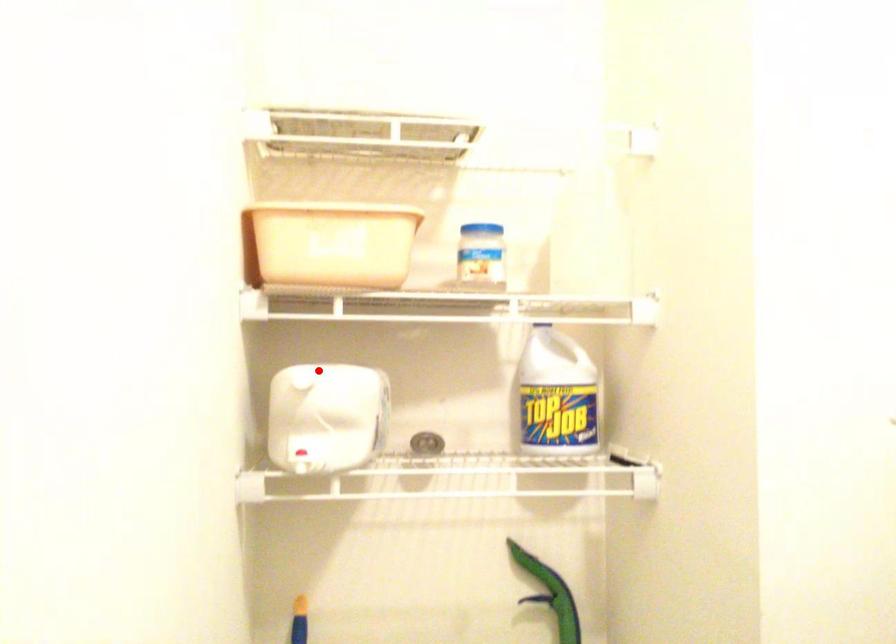
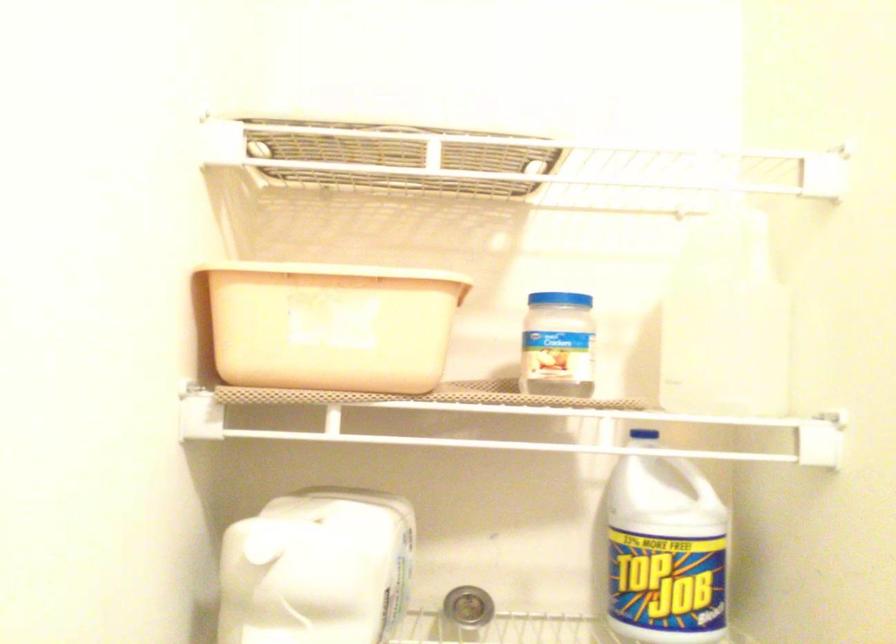
Find the pixel in the second image that matches the highlighted location in the first image.

(309, 506)